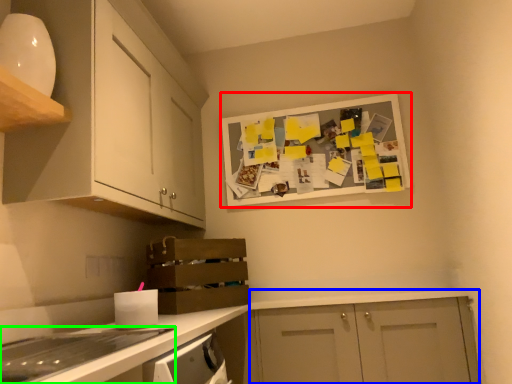
Question: Which object is the closest to the bulletin board (highlighted by a red box)? Choose among these: cabinetry (highlighted by a blue box) or home appliance (highlighted by a green box).

Choices:
 (A) cabinetry
 (B) home appliance

Answer: (A)